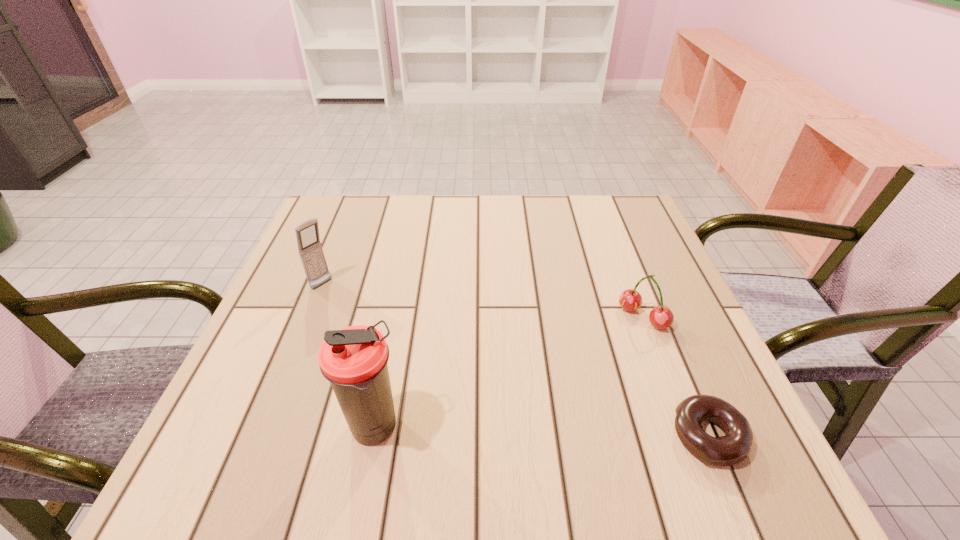
The image size is (960, 540). In order to click on vacant space on the desktop that is between the second object from left to right and the doughnut and is positioned on the front-facing side of the cellular telephone in this screenshot , I will do `click(516, 431)`.

The height and width of the screenshot is (540, 960). What are the coordinates of `vacant spot on the desktop that is between the third object from right to left and the shortest object and is positioned with stems pointing upwards on the third nearest object` in the screenshot? It's located at (516, 431).